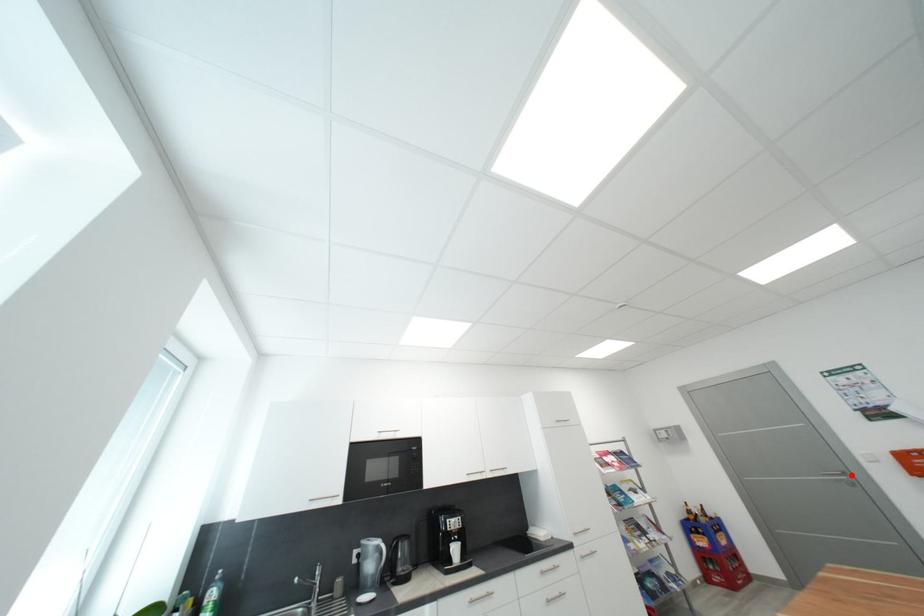
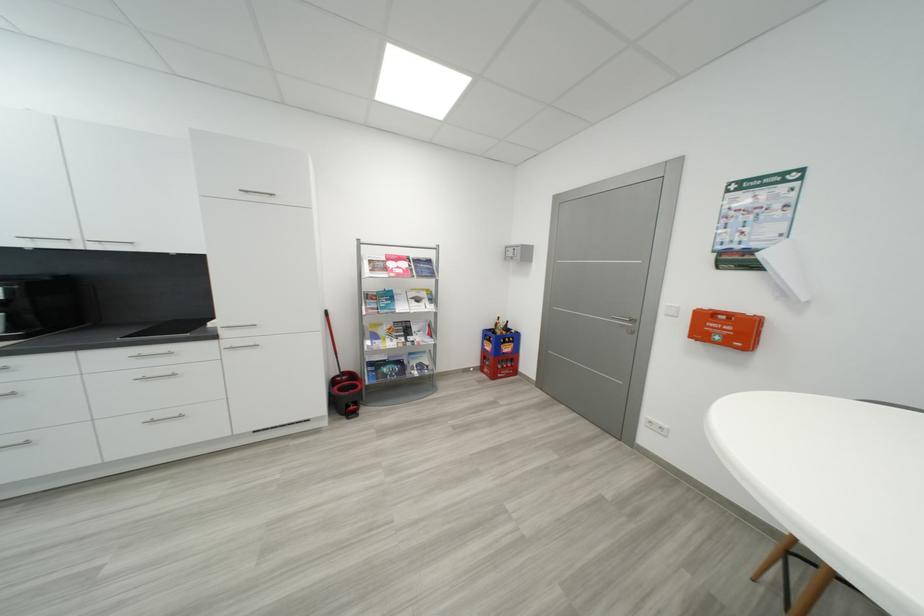
The point at the highlighted location is marked in the first image. Where is the corresponding point in the second image?

(639, 322)